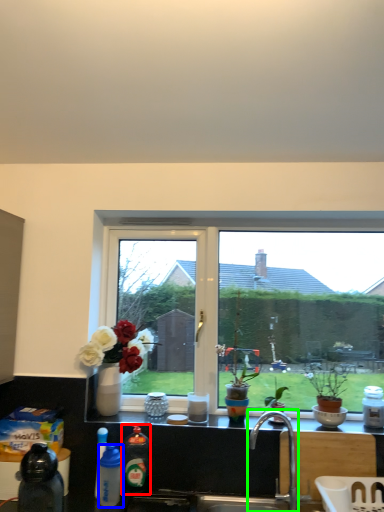
Question: Which is farther away from bottle (highlighted by a red box)? bottle (highlighted by a blue box) or tap (highlighted by a green box)?

Choices:
 (A) bottle
 (B) tap

Answer: (B)